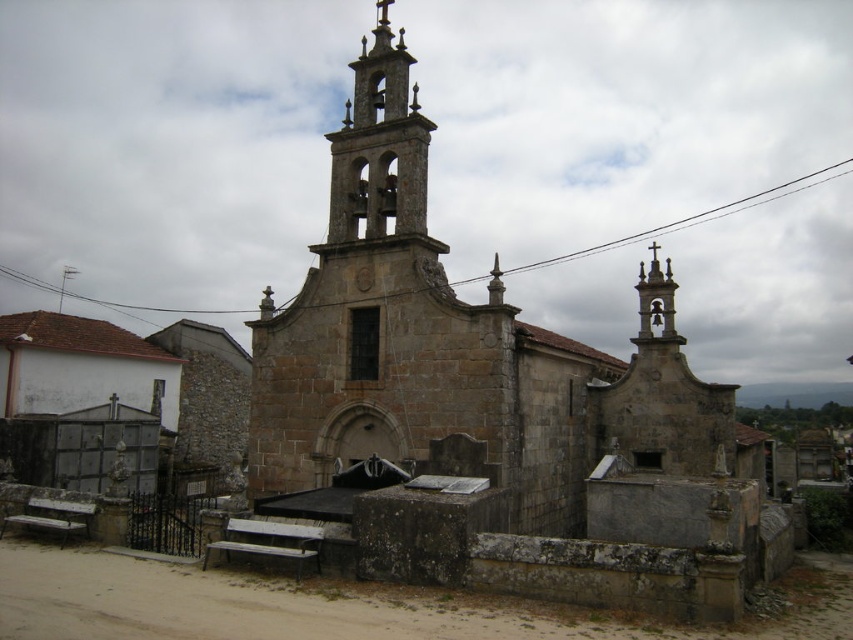
Question: Which of the following is the closest to the observer?

Choices:
 (A) (375, 84)
 (B) (381, 285)

Answer: (B)

Question: Does stone bell tower at center have a larger size compared to stone bell tower at upper center?

Choices:
 (A) yes
 (B) no

Answer: (A)

Question: Can you confirm if stone bell tower at center is positioned to the right of stone bell tower at upper center?

Choices:
 (A) yes
 (B) no

Answer: (B)

Question: Which of the following is the farthest from the observer?

Choices:
 (A) (376, 36)
 (B) (422, 148)

Answer: (A)

Question: Does stone bell tower at center have a lesser width compared to stone bell tower at upper center?

Choices:
 (A) no
 (B) yes

Answer: (A)